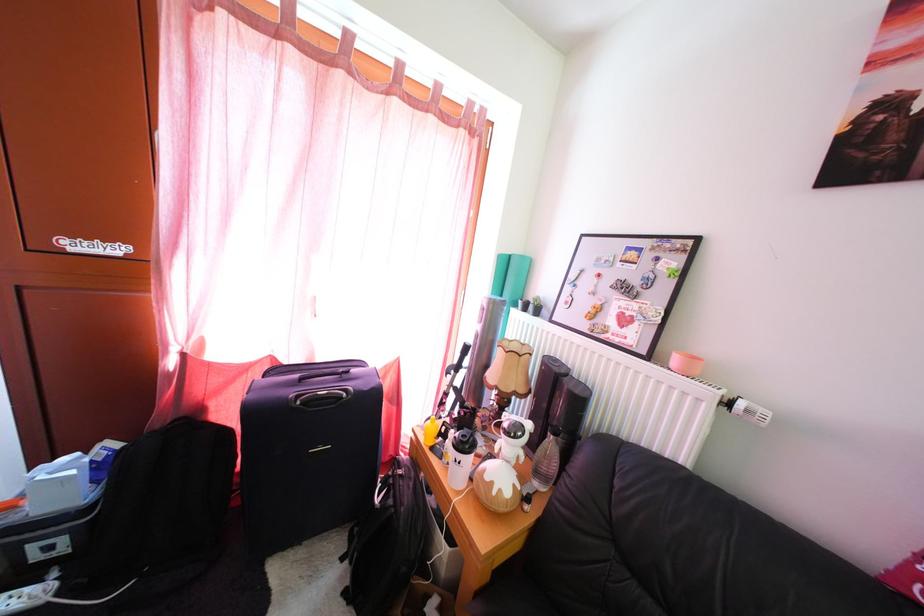
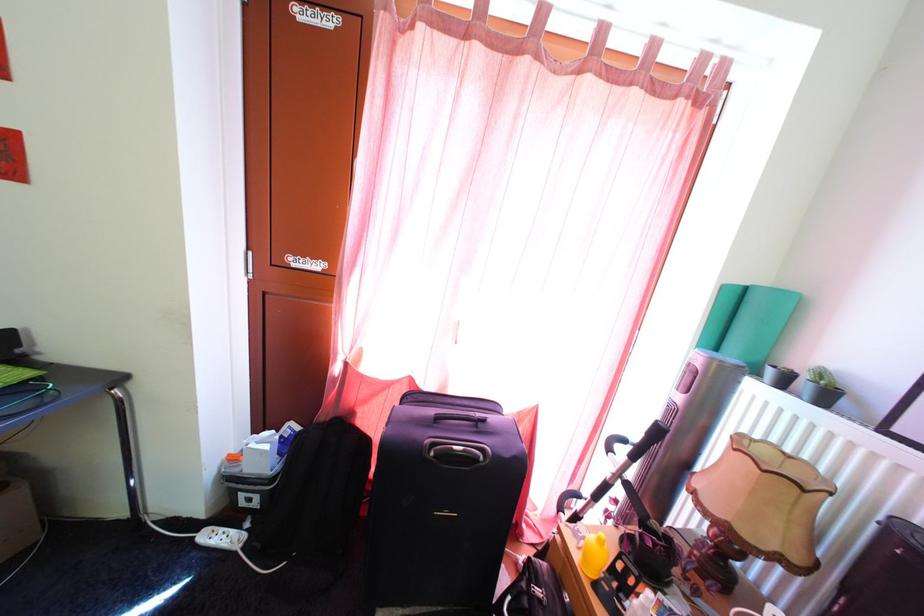
Locate, in the second image, the point that corresponds to point (431, 448) in the first image.

(585, 565)